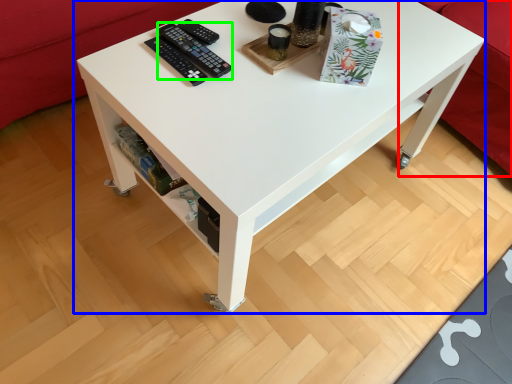
Question: Estimate the real-world distances between objects in this image. Which object is closer to couch (highlighted by a red box), table (highlighted by a blue box) or control (highlighted by a green box)?

Choices:
 (A) table
 (B) control

Answer: (A)